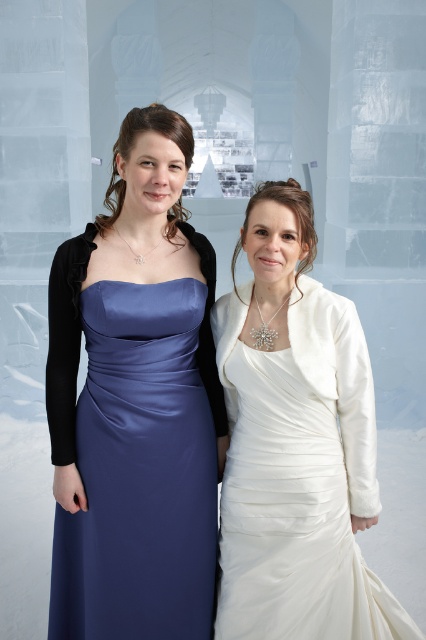
Question: Is satin dress at left thinner than white satin dress at right?

Choices:
 (A) no
 (B) yes

Answer: (B)

Question: Which of the following is the farthest from the observer?

Choices:
 (A) (224, 323)
 (B) (97, 604)

Answer: (A)

Question: Which object is closer to the camera taking this photo?

Choices:
 (A) white satin dress at right
 (B) satin dress at left

Answer: (B)

Question: Is satin dress at left above white satin dress at right?

Choices:
 (A) no
 (B) yes

Answer: (B)

Question: Is satin dress at left above white satin dress at right?

Choices:
 (A) no
 (B) yes

Answer: (B)

Question: Which object is farther from the camera taking this photo?

Choices:
 (A) satin dress at left
 (B) white satin dress at right

Answer: (B)